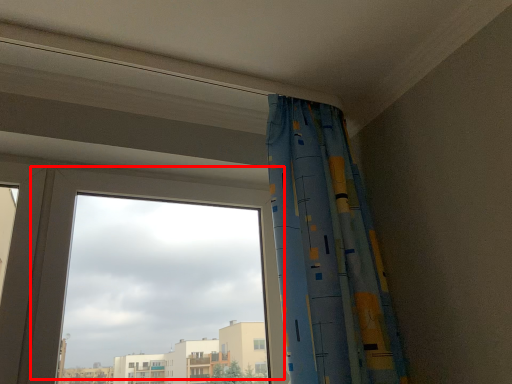
Question: In this image, where is window (annotated by the red box) located relative to curtain?

Choices:
 (A) right
 (B) left

Answer: (B)